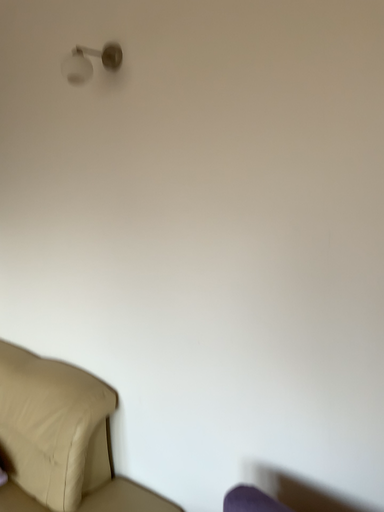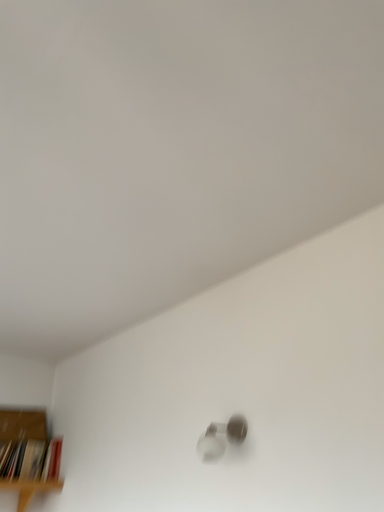
Question: Which way did the camera rotate in the video?

Choices:
 (A) rotated downward
 (B) rotated upward

Answer: (B)